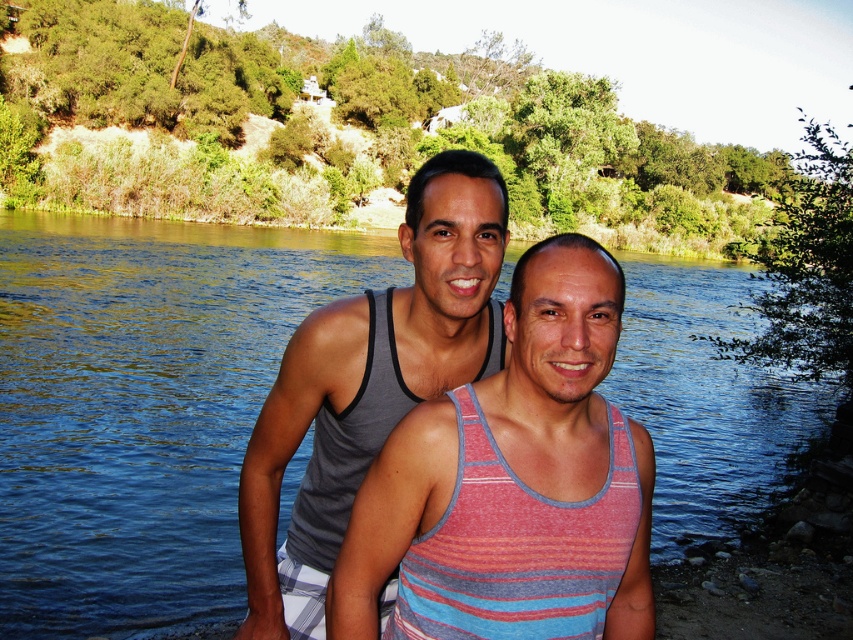
Is striped cotton tank top at center closer to camera compared to gray heather tank top at center?

Yes, it is in front of gray heather tank top at center.

Does point (624, 592) come in front of point (254, 563)?

Yes, point (624, 592) is closer to viewer.

You are a GUI agent. You are given a task and a screenshot of the screen. Output one action in this format:
    pyautogui.click(x=<x>, y=<y>)
    Task: Click on the striped cotton tank top at center
    
    Given the screenshot: What is the action you would take?
    pyautogui.click(x=514, y=484)

Who is shorter, blue water at center or striped cotton tank top at center?

striped cotton tank top at center

Is point (144, 228) behind point (556, 412)?

Yes, it is behind point (556, 412).

The width and height of the screenshot is (853, 640). Find the location of `blue water at center`. blue water at center is located at coordinates (142, 404).

Does blue water at center appear under gray heather tank top at center?

Incorrect, blue water at center is not positioned below gray heather tank top at center.

Is the position of blue water at center more distant than that of gray heather tank top at center?

Yes.

Find the location of a particular element. blue water at center is located at coordinates (142, 404).